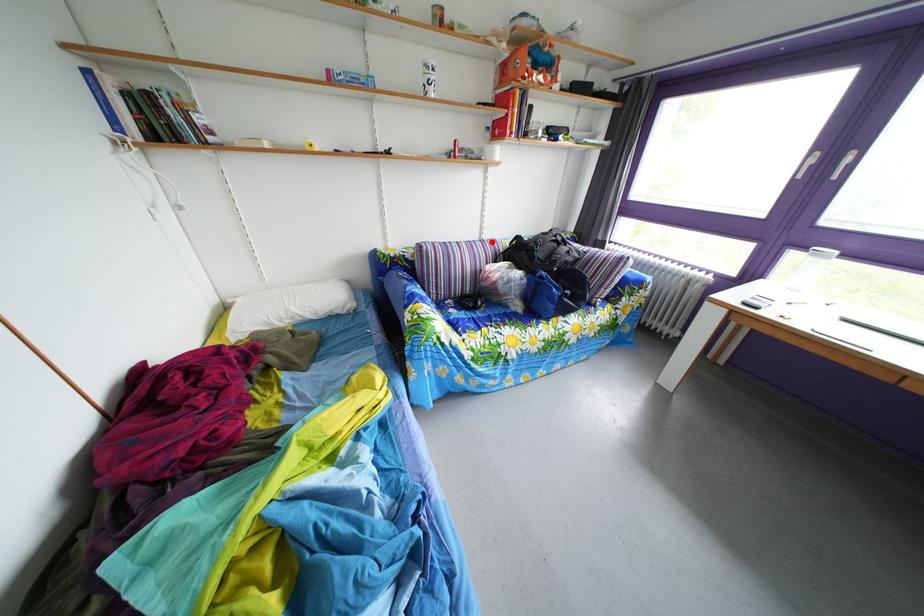
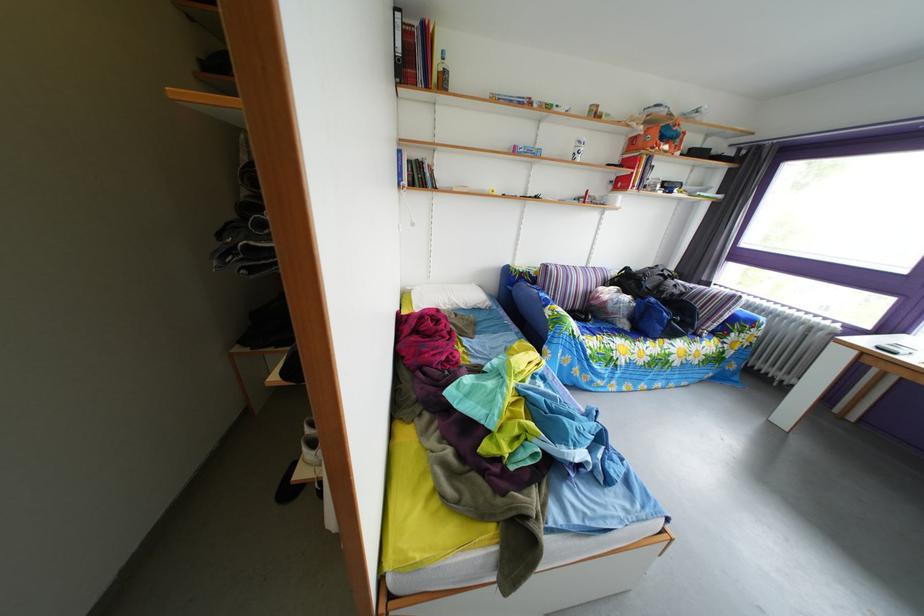
In the second image, find the point that corresponds to the highlighted location in the first image.

(599, 270)